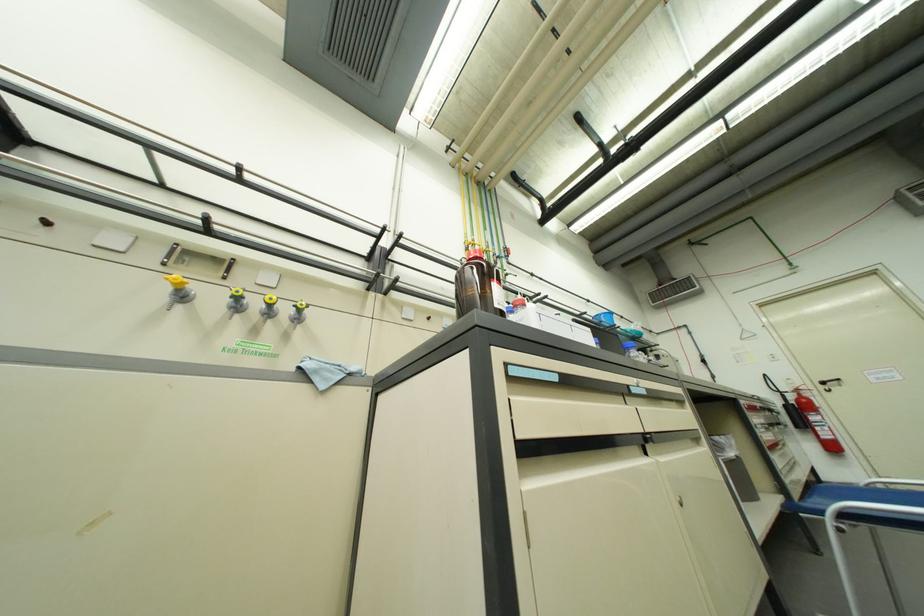
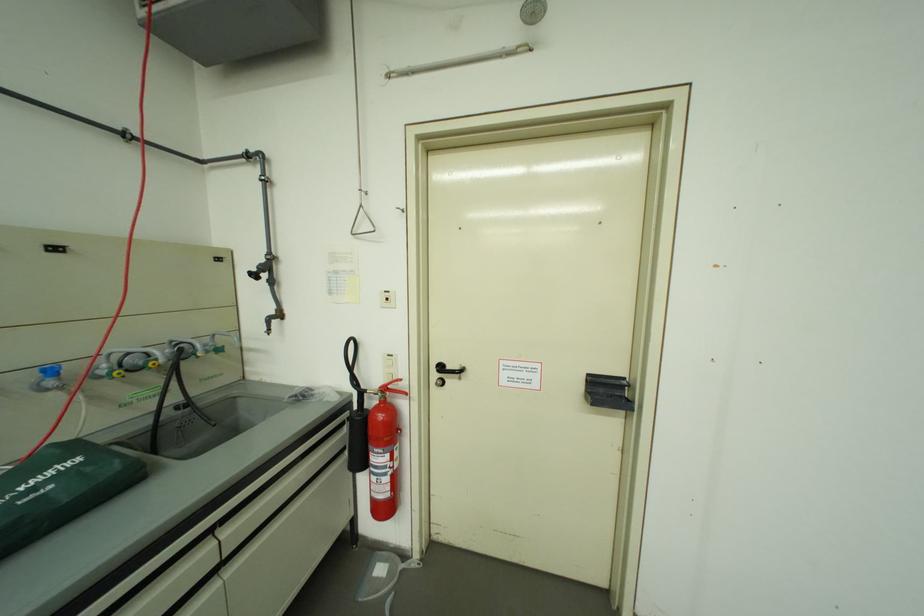
Find the pixel in the second image that matches [833,384] in the first image.

(451, 369)